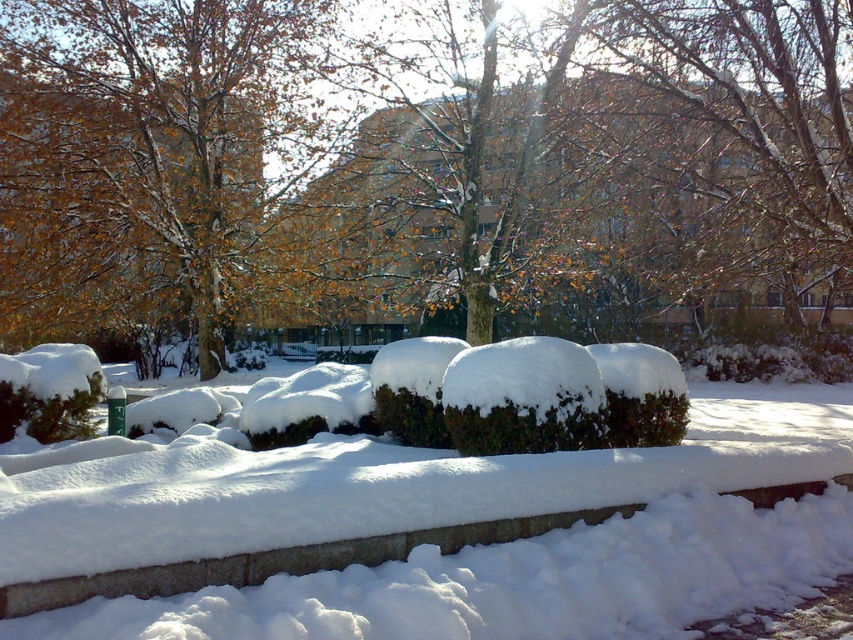
Is white fluffy snow at center below brown textured tree at upper center?

Indeed, white fluffy snow at center is positioned under brown textured tree at upper center.

Who is more distant from viewer, (554, 477) or (227, 60)?

Positioned behind is point (227, 60).

Who is more distant from viewer, (82, 476) or (61, 282)?

Positioned behind is point (61, 282).

At what (x,y) coordinates should I click in order to perform the action: click on white fluffy snow at center. Please return your answer as a coordinate pair (x, y). This screenshot has height=640, width=853. Looking at the image, I should click on (396, 536).